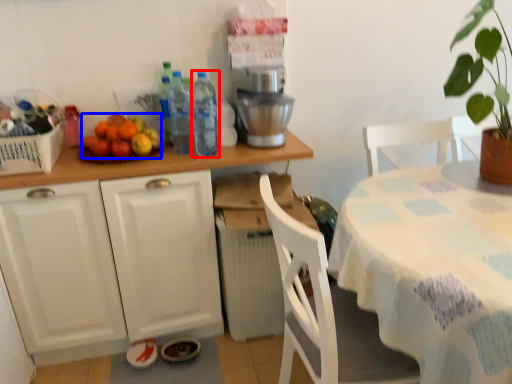
Question: Which object appears farthest to the camera in this image, bottle (highlighted by a red box) or fruit (highlighted by a blue box)?

Choices:
 (A) bottle
 (B) fruit

Answer: (B)